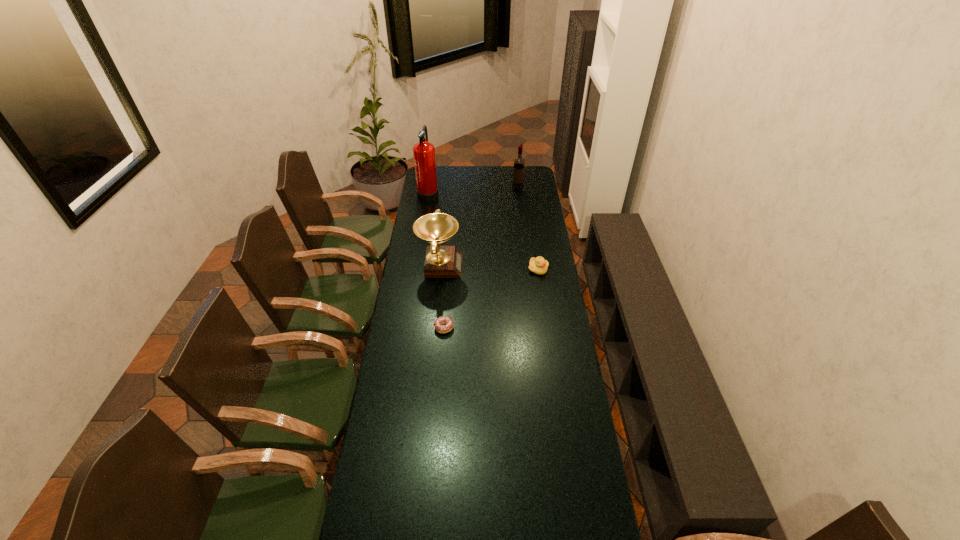
What are the coordinates of `empty location between the wine bottle and the tallest object` in the screenshot? It's located at (473, 191).

Identify the location of free space between the award and the duckling. (489, 267).

In order to click on free space between the duckling and the nearest object in this screenshot , I will do `click(491, 298)`.

The height and width of the screenshot is (540, 960). I want to click on free space between the fourth shortest object and the tallest object, so click(473, 191).

Where is `object that is the second nearest to the fourth tallest object`? The height and width of the screenshot is (540, 960). object that is the second nearest to the fourth tallest object is located at coordinates (440, 328).

Identify the location of object that is the third closest one to the fire extinguisher. This screenshot has width=960, height=540. pyautogui.click(x=538, y=265).

The height and width of the screenshot is (540, 960). I want to click on free region that satisfies the following two spatial constraints: 1. on the front-facing side of the third shortest object; 2. on the left side of the nearest object, so click(x=434, y=328).

Identify the location of free space that satisfies the following two spatial constraints: 1. on the back side of the fourth shortest object; 2. on the left side of the tallest object. The width and height of the screenshot is (960, 540). (429, 190).